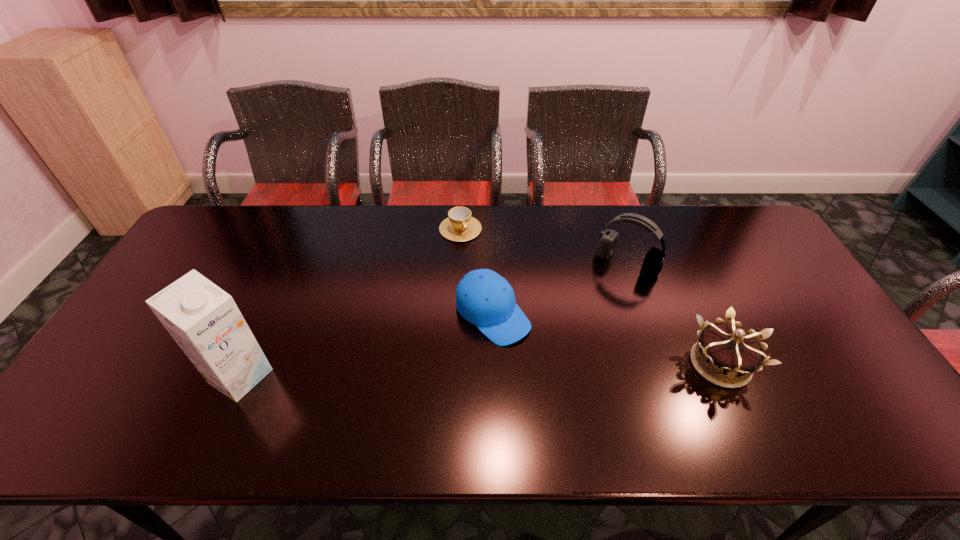
This screenshot has height=540, width=960. Find the location of `free spot between the third shortest object and the cup`. free spot between the third shortest object and the cup is located at coordinates coord(590,296).

What are the coordinates of `vacant point located between the leftmost object and the cap` in the screenshot? It's located at (x=367, y=345).

Find the location of a particular element. The image size is (960, 540). vacant space that's between the fourth nearest object and the shortest object is located at coordinates (543, 246).

This screenshot has width=960, height=540. Find the location of `empty location between the crown and the headset`. empty location between the crown and the headset is located at coordinates (673, 314).

This screenshot has height=540, width=960. I want to click on object that stands as the closest to the carton, so click(x=484, y=298).

At what (x,y) coordinates should I click in order to perform the action: click on object that stands as the second closest to the headset. Please return your answer as a coordinate pair (x, y). The width and height of the screenshot is (960, 540). Looking at the image, I should click on (484, 298).

Where is `vacant space that satisfies the following two spatial constraints: 1. on the front side of the shortest object; 2. on the left side of the crown`? vacant space that satisfies the following two spatial constraints: 1. on the front side of the shortest object; 2. on the left side of the crown is located at coordinates (454, 364).

Image resolution: width=960 pixels, height=540 pixels. Find the location of `free space that satisfies the following two spatial constraints: 1. on the back side of the shortest object; 2. on the left side of the leftmost object`. free space that satisfies the following two spatial constraints: 1. on the back side of the shortest object; 2. on the left side of the leftmost object is located at coordinates (306, 229).

Where is `vacant space that satisfies the following two spatial constraints: 1. on the front side of the third shortest object; 2. on the left side of the fourth tallest object`? This screenshot has width=960, height=540. vacant space that satisfies the following two spatial constraints: 1. on the front side of the third shortest object; 2. on the left side of the fourth tallest object is located at coordinates (494, 364).

The image size is (960, 540). In order to click on free spot that satisfies the following two spatial constraints: 1. on the front side of the fourth nearest object; 2. on the left side of the third tallest object in this screenshot , I will do `click(660, 364)`.